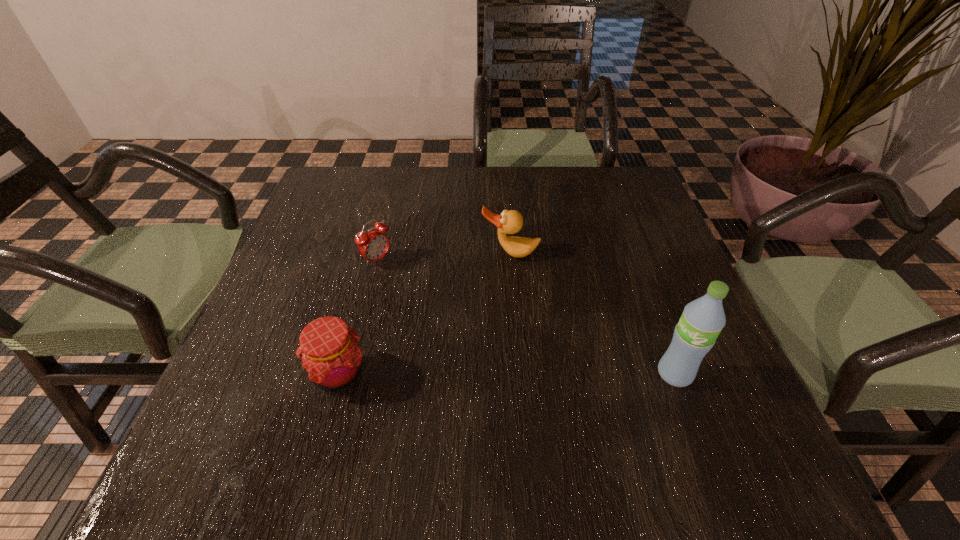
Image resolution: width=960 pixels, height=540 pixels. I want to click on free spot between the second object from right to left and the jam, so click(424, 313).

The height and width of the screenshot is (540, 960). I want to click on vacant space that's between the alarm clock and the third object from left to right, so click(x=444, y=257).

Locate an element on the screen. free space between the alarm clock and the rightmost object is located at coordinates (526, 317).

Where is `empty space between the rightmost object and the duck`? The width and height of the screenshot is (960, 540). empty space between the rightmost object and the duck is located at coordinates (592, 314).

Where is `empty space between the jam and the third object from left to right`? Image resolution: width=960 pixels, height=540 pixels. empty space between the jam and the third object from left to right is located at coordinates 424,313.

Image resolution: width=960 pixels, height=540 pixels. Identify the location of the closest object relative to the jam. (373, 245).

Where is `object that is the nearest to the third object from left to right`? object that is the nearest to the third object from left to right is located at coordinates (373, 245).

Find the location of a particular element. The width and height of the screenshot is (960, 540). free space that satisfies the following two spatial constraints: 1. on the back side of the duck; 2. on the right side of the jam is located at coordinates (372, 254).

Identify the location of vacant space that satisfies the following two spatial constraints: 1. on the front side of the tallest object; 2. on the right side of the alarm clock. (349, 374).